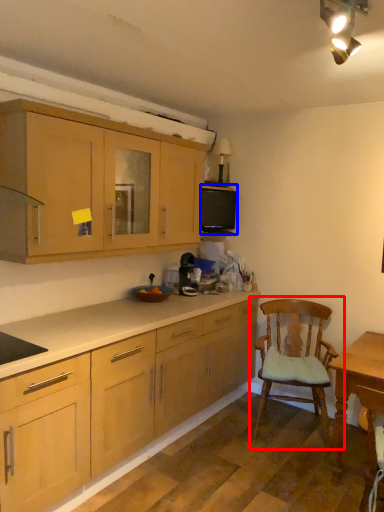
Question: Which object appears farthest to the camera in this image, chair (highlighted by a red box) or appliance (highlighted by a blue box)?

Choices:
 (A) chair
 (B) appliance

Answer: (B)